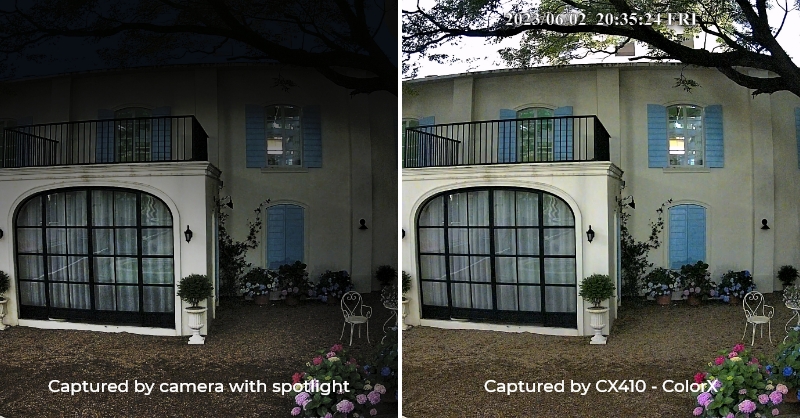
The width and height of the screenshot is (800, 418). In order to click on upper storey windows in this screenshot , I will do `click(686, 130)`, `click(532, 130)`, `click(408, 146)`, `click(282, 152)`, `click(130, 149)`, `click(6, 145)`.